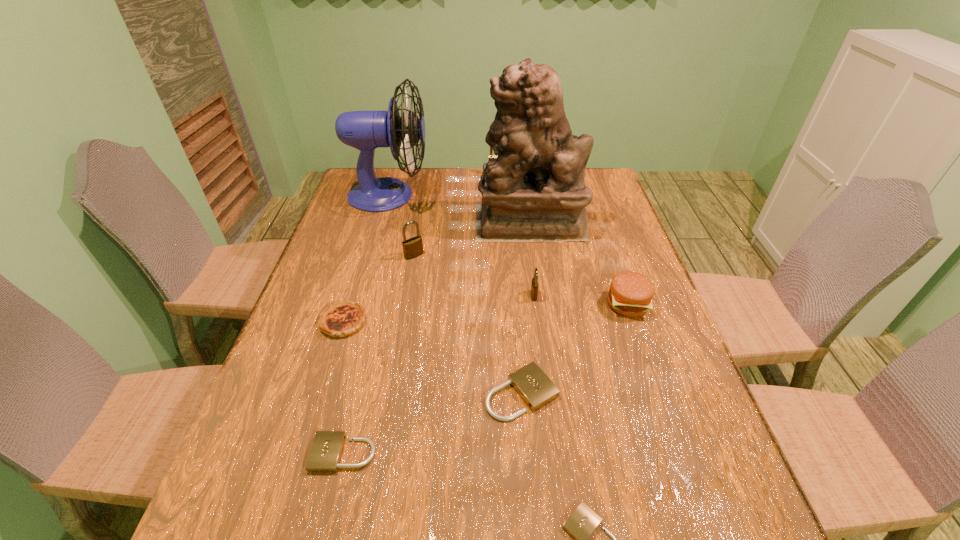
Locate an element on the screen. The width and height of the screenshot is (960, 540). the biggest beige padlock is located at coordinates (536, 389).

Identify the location of the eighth farthest object. (536, 389).

Locate an element on the screen. The width and height of the screenshot is (960, 540). the second nearest padlock is located at coordinates (326, 450).

The image size is (960, 540). What are the coordinates of `the second nearest beige padlock` in the screenshot? It's located at pos(326,450).

Where is `vacant region located 0.200m on the front-facing side of the sculpture`? The image size is (960, 540). vacant region located 0.200m on the front-facing side of the sculpture is located at coordinates (413, 221).

Find the location of `vacant region located on the front-facing side of the sculpture`. vacant region located on the front-facing side of the sculpture is located at coordinates (447, 221).

This screenshot has width=960, height=540. What are the coordinates of `vacant space located on the front-facing side of the sculpture` in the screenshot? It's located at (453, 221).

The image size is (960, 540). Find the location of `free point located 0.280m in front of the second tallest object where the airflow is directed`. free point located 0.280m in front of the second tallest object where the airflow is directed is located at coordinates (511, 195).

This screenshot has height=540, width=960. I want to click on vacant position located on the right of the second brass padlock from left to right, so click(538, 175).

Identify the location of vacant region located 0.220m on the left of the leftmost brass padlock. (329, 255).